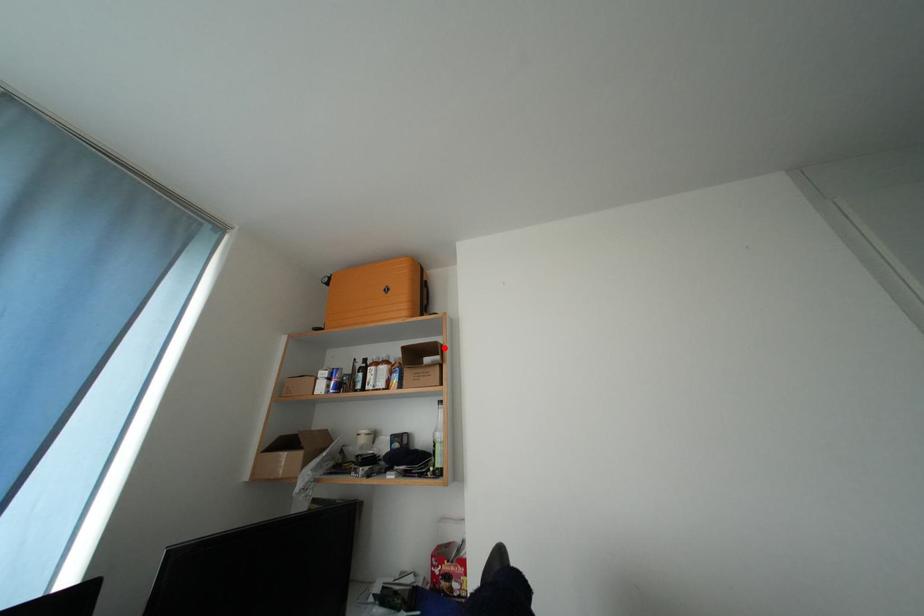
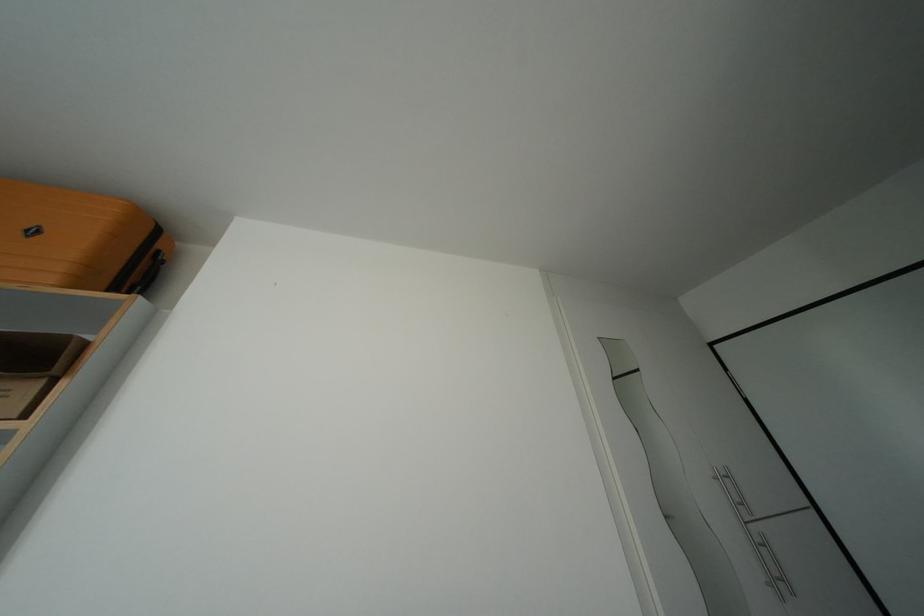
Find the pixel in the second image that matches the highlighted location in the first image.

(76, 342)